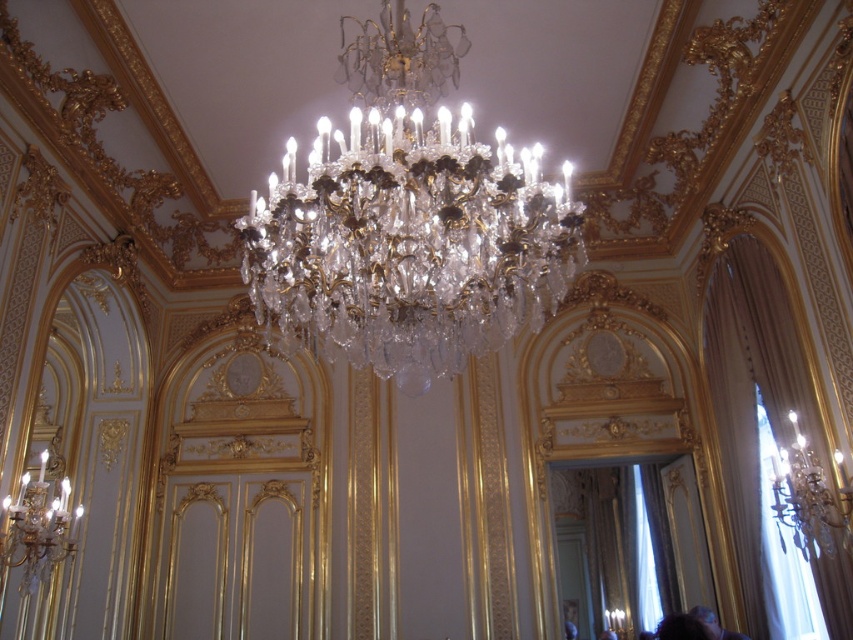
You are a photographer standing in the room and want to capture a portrait of the person with dark hair at lower right and smooth skin face at lower right. Which part of the person should you focus on to ensure the face is clearly visible?

The dark hair at lower right is positioned over smooth skin face at lower right, so focusing on the smooth skin face at lower right will ensure the face is clearly visible.